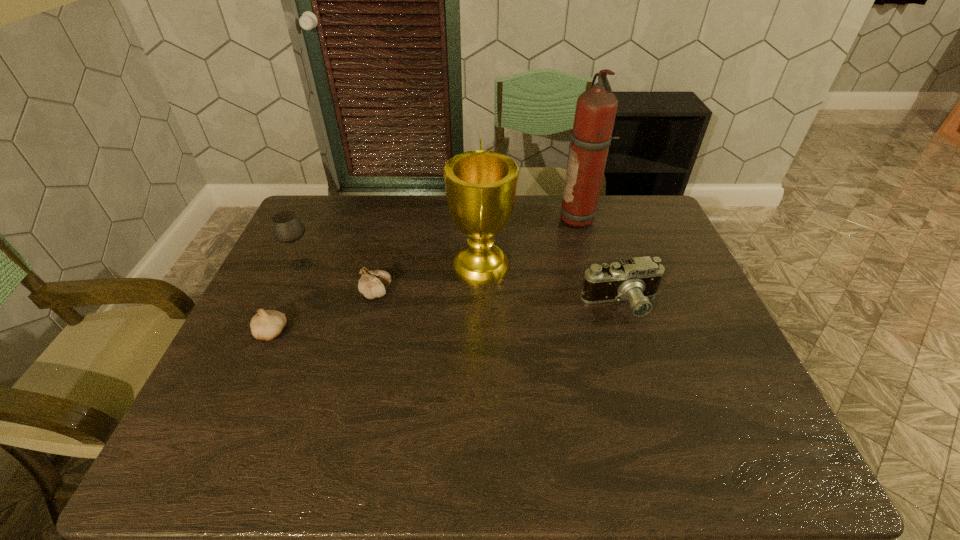
At what (x,y) coordinates should I click in order to perform the action: click on award at the far edge. Please return your answer as a coordinate pair (x, y). This screenshot has width=960, height=540. Looking at the image, I should click on (480, 185).

Identify the location of wineglass that is at the left edge. (286, 227).

At what (x,y) coordinates should I click in order to perform the action: click on garlic positioned at the left edge. Please return your answer as a coordinate pair (x, y). This screenshot has height=540, width=960. Looking at the image, I should click on (266, 325).

Where is `object positioned at the right edge`? The width and height of the screenshot is (960, 540). object positioned at the right edge is located at coordinates (636, 279).

Image resolution: width=960 pixels, height=540 pixels. I want to click on vacant region at the far edge of the desktop, so (362, 199).

Where is `vacant space at the near edge of the desktop`? This screenshot has width=960, height=540. vacant space at the near edge of the desktop is located at coordinates (445, 440).

This screenshot has height=540, width=960. What are the coordinates of `vacant space at the left edge of the desktop` in the screenshot? It's located at (312, 280).

This screenshot has width=960, height=540. I want to click on vacant region at the right edge, so click(x=703, y=295).

The image size is (960, 540). In the image, there is a desktop. In order to click on vacant area at the far left corner in this screenshot , I will do `click(317, 199)`.

The width and height of the screenshot is (960, 540). What are the coordinates of `vacant space at the near left corner` in the screenshot? It's located at (203, 463).